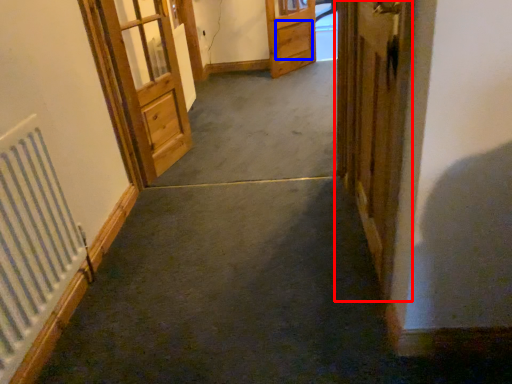
Question: Which object appears farthest to the camera in this image, door (highlighted by a red box) or drawer (highlighted by a blue box)?

Choices:
 (A) door
 (B) drawer

Answer: (B)